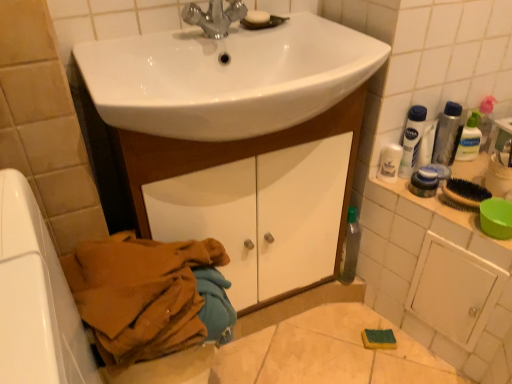
At what (x,y) coordinates should I click in order to perform the action: click on vacant space in front of clear plastic bottle at upper right, acting as the second toiletry starting from the bottom. Please return your answer as a coordinate pair (x, y). Image resolution: width=512 pixels, height=384 pixels. Looking at the image, I should click on (475, 174).